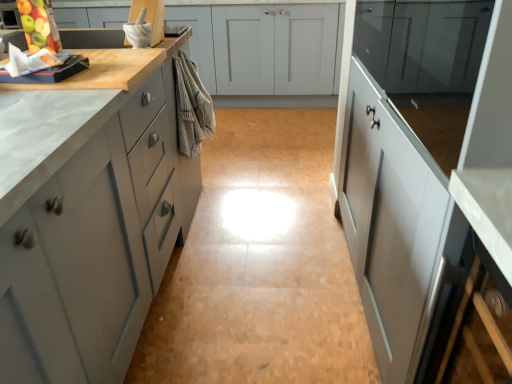
Question: Looking at their shapes, would you say green matte apple at upper left is wider or thinner than glossy white cabinet at right, acting as the 3th cabinetry starting from the back?

Choices:
 (A) wide
 (B) thin

Answer: (B)

Question: Would you say green matte apple at upper left is to the left or to the right of glossy white cabinet at right, which is the 2th cabinetry from front to back, in the picture?

Choices:
 (A) left
 (B) right

Answer: (A)

Question: Which of these objects is positioned closest to the glossy white cabinet at right, which is the 2th cabinetry from front to back?

Choices:
 (A) matte gray cabinets at left, which is counted as the 1th cabinetry, starting from the front
 (B) green matte apple at upper left
 (C) glossy glass cabinet at upper right, the third cabinetry from the front
 (D) matte gray cabinets at center, placed as the 4th cabinetry when sorted from front to back
 (E) beige textured towel at center

Answer: (C)

Question: Which is nearer to the beige textured towel at center?

Choices:
 (A) matte gray cabinets at left, which is counted as the 1th cabinetry, starting from the front
 (B) green matte apple at upper left
 (C) matte gray cabinets at center, placed as the 4th cabinetry when sorted from front to back
 (D) glossy white cabinet at right, which is the 2th cabinetry from front to back
 (E) glossy glass cabinet at upper right, the second cabinetry from the back

Answer: (A)